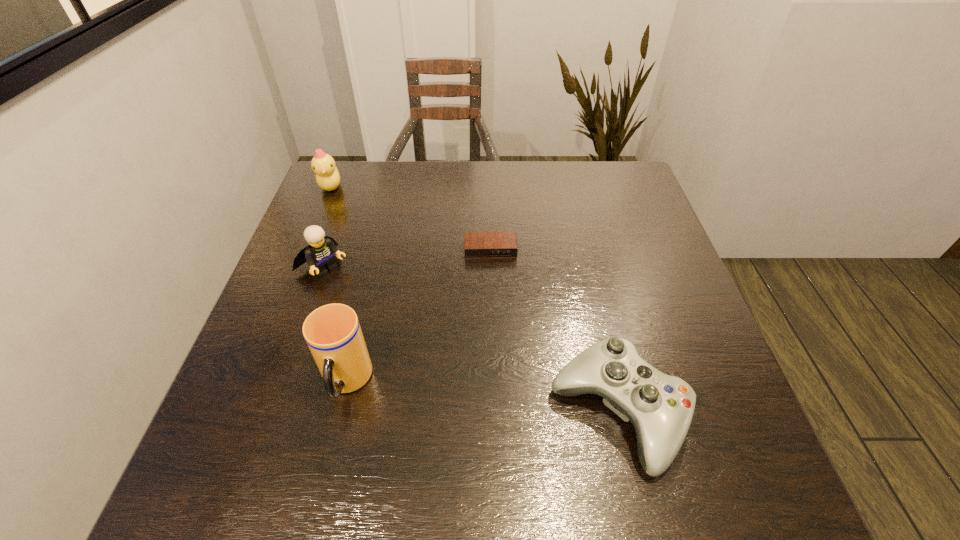
Locate an element on the screen. free spot on the desktop that is between the third object from left to right and the control and is positioned on the front-facing side of the duckling is located at coordinates (508, 400).

Identify the location of free space on the desktop that is between the tallest object and the fourth tallest object and is positioned on the front-facing side of the Lego. (x=473, y=396).

The height and width of the screenshot is (540, 960). In order to click on vacant space on the desktop that is between the cup and the rightmost object and is positioned on the front face of the shortest object in this screenshot , I will do `click(499, 399)`.